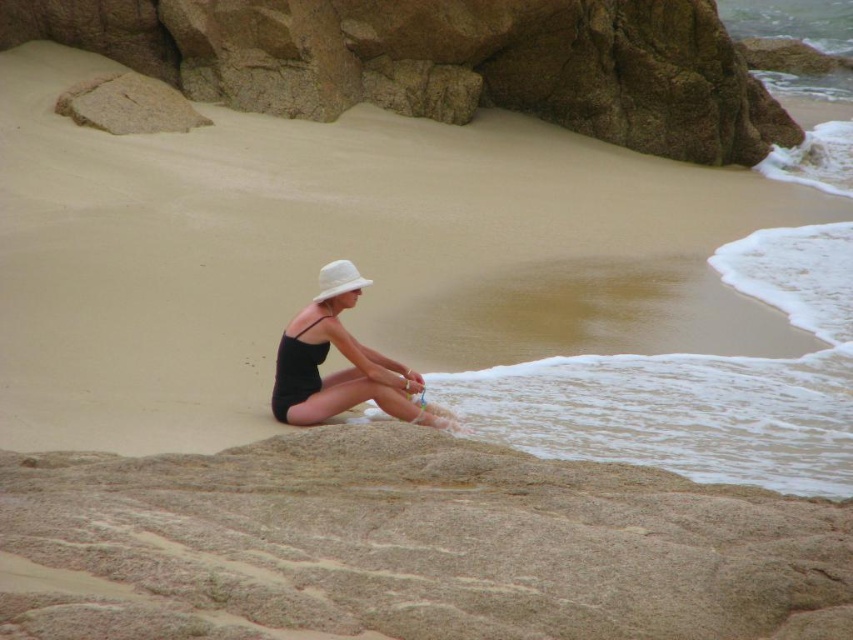
You are standing on the beach and see the smooth beige sand at lower center and the white matte hat at center. Which object is located lower in the scene?

The smooth beige sand at lower center is located below the white matte hat at center, so it is lower in the scene.